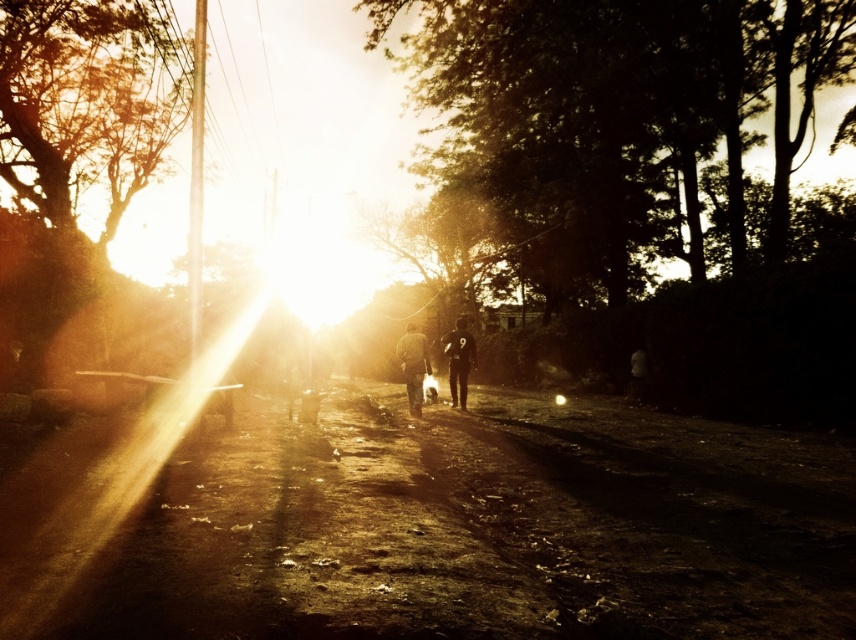
Question: Is dark fabric jacket at center smaller than black matte uniform at center?

Choices:
 (A) no
 (B) yes

Answer: (A)

Question: Estimate the real-world distances between objects in this image. Which object is closer to the black matte uniform at center?

Choices:
 (A) dark fabric jacket at center
 (B) silhouetted bark tree at center
 (C) dusty brown dirt track at center
 (D) silhouetted bark tree at left

Answer: (A)

Question: Which object is closer to the camera taking this photo?

Choices:
 (A) dark fabric jacket at center
 (B) black matte uniform at center
 (C) silhouetted bark tree at center

Answer: (C)

Question: Does dusty brown dirt track at center have a larger size compared to dark fabric jacket at center?

Choices:
 (A) yes
 (B) no

Answer: (A)

Question: Does silhouetted bark tree at center have a larger size compared to dark fabric jacket at center?

Choices:
 (A) no
 (B) yes

Answer: (B)

Question: Which is nearer to the silhouetted bark tree at left?

Choices:
 (A) silhouetted bark tree at center
 (B) dusty brown dirt track at center
 (C) black matte uniform at center

Answer: (B)